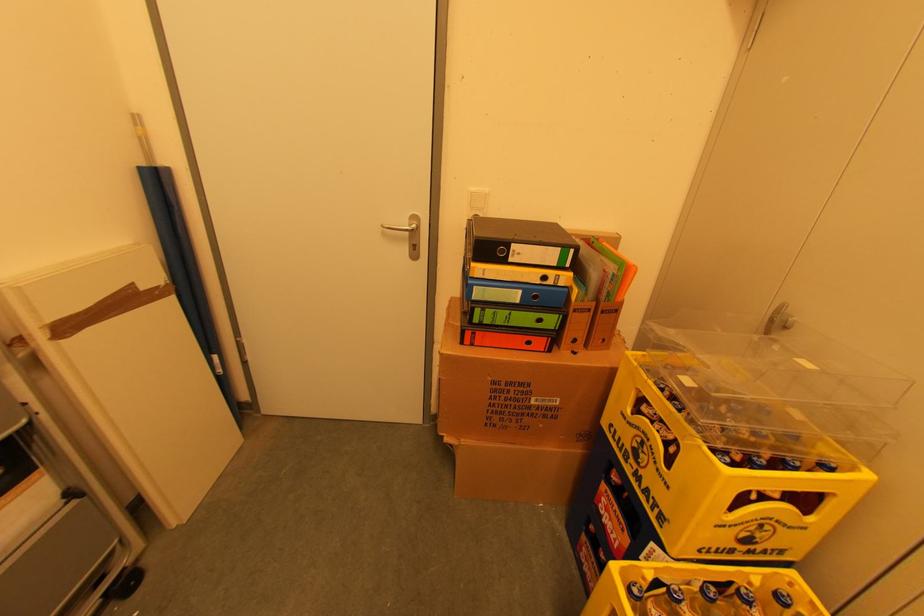
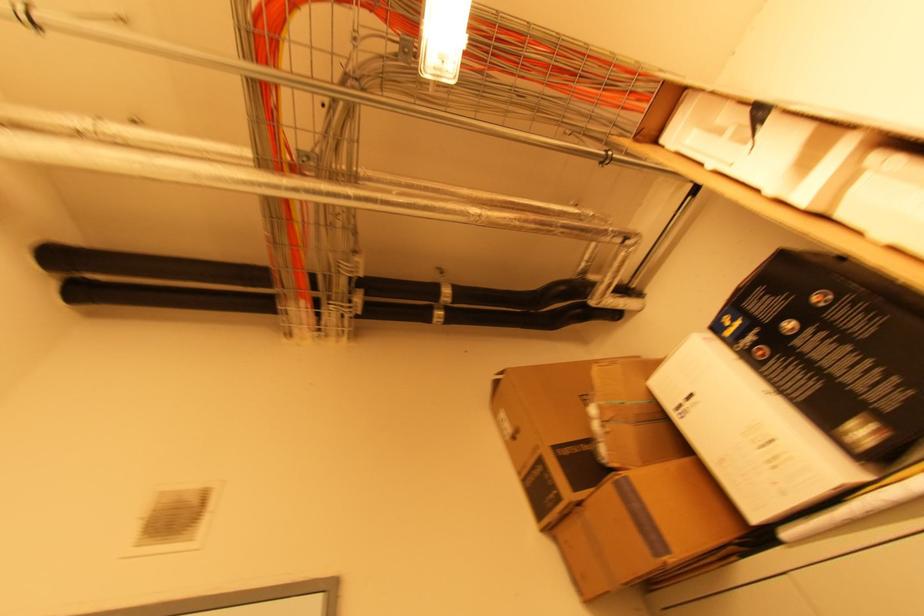
How did the camera likely rotate?

The camera rotated toward right-up.